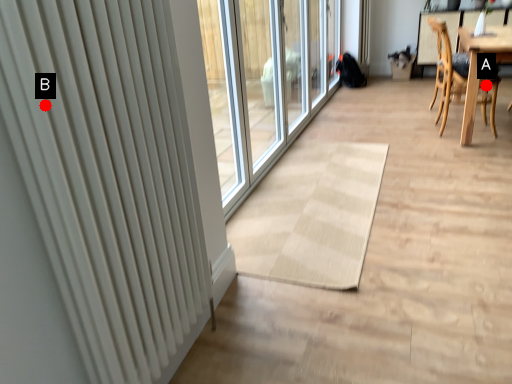
Question: Two points are circled on the image, labeled by A and B beside each circle. Among these points, which one is farthest from the camera?

Choices:
 (A) A is further
 (B) B is further

Answer: (A)